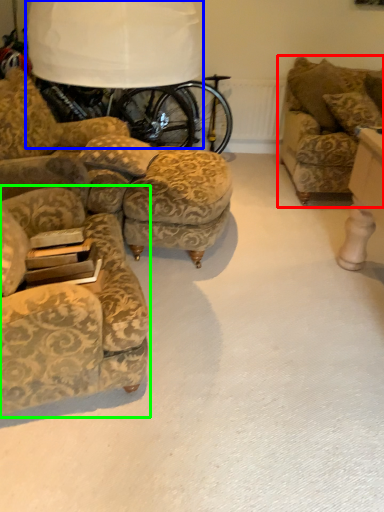
Question: Which object is positioned closest to studio couch (highlighted by a red box)? Select from table lamp (highlighted by a blue box) and chair (highlighted by a green box).

Choices:
 (A) table lamp
 (B) chair

Answer: (A)